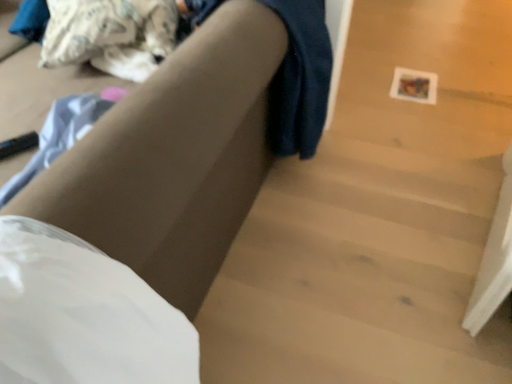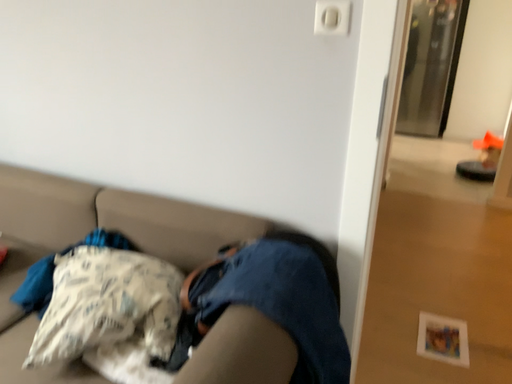
Question: How did the camera likely rotate when shooting the video?

Choices:
 (A) rotated upward
 (B) rotated downward

Answer: (A)